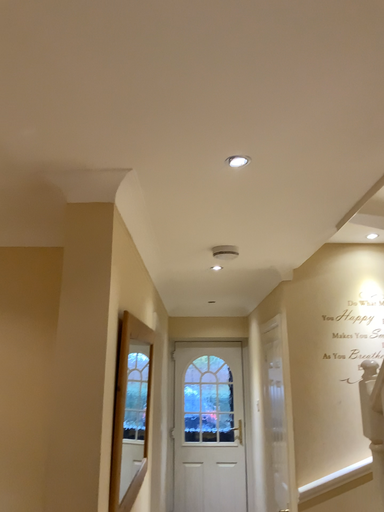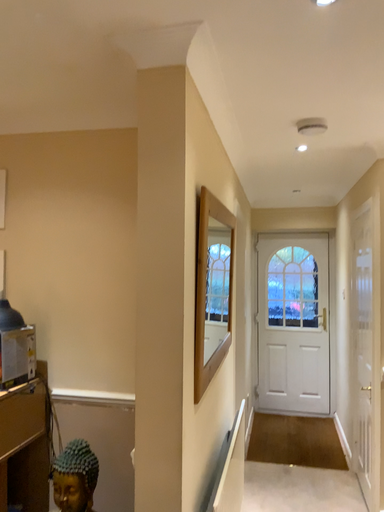
Question: Which way did the camera rotate in the video?

Choices:
 (A) rotated downward
 (B) rotated upward

Answer: (A)